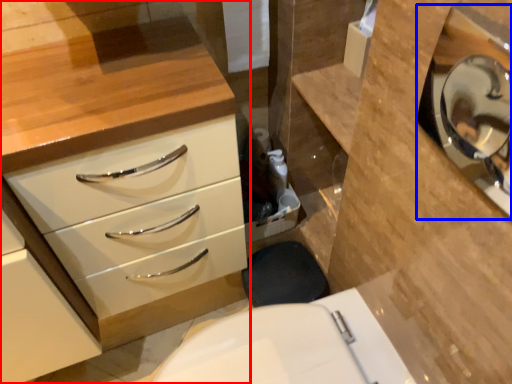
Question: Which of the following is the closest to the observer, chest of drawers (highlighted by a red box) or medicine cabinet (highlighted by a blue box)?

Choices:
 (A) chest of drawers
 (B) medicine cabinet

Answer: (B)